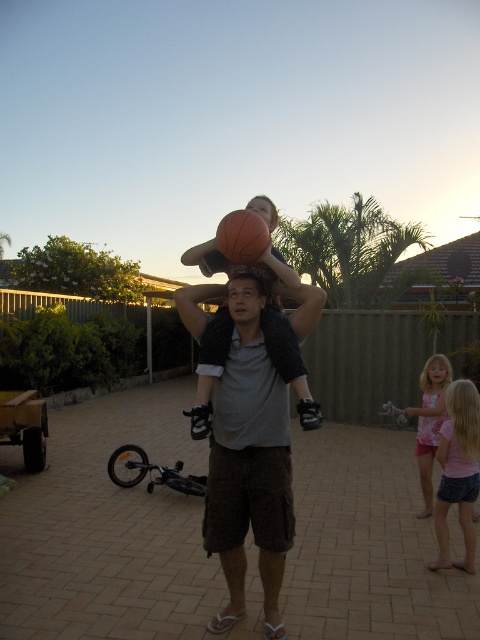
You are organizing a charity event and need to decide which clothing item to place on a 1.2 meter wide display stand. The gray cotton shirt at center and the pink fabric dress at lower right are both candidates. Based on their sizes, which item would fit better on the stand?

The gray cotton shirt at center has a larger width than the pink fabric dress at lower right. Since the display stand is 1.2 meters wide, the gray cotton shirt at center would fit better as it can utilize the space more effectively.

You are a photographer trying to capture the scene. You want to ensure the gray cotton shirt at center and the matte orange basketball at center are both in focus. Since the basketball is further away from you, which object should you focus on to ensure both are sharp?

You should focus on the gray cotton shirt at center because it is closer to you than the matte orange basketball at center. By focusing on the closer object, the depth of field will extend to the basketball, keeping both in focus.

In the scene shown: You are a photographer trying to capture the man and child in the scene. Since the gray cotton shirt at center and the matte orange basketball at center are both in the frame, which one should you focus on to ensure the other is also in focus?

The gray cotton shirt at center is in front of the matte orange basketball at center, so focusing on the gray cotton shirt at center will ensure the matte orange basketball at center is also in focus since it is behind.